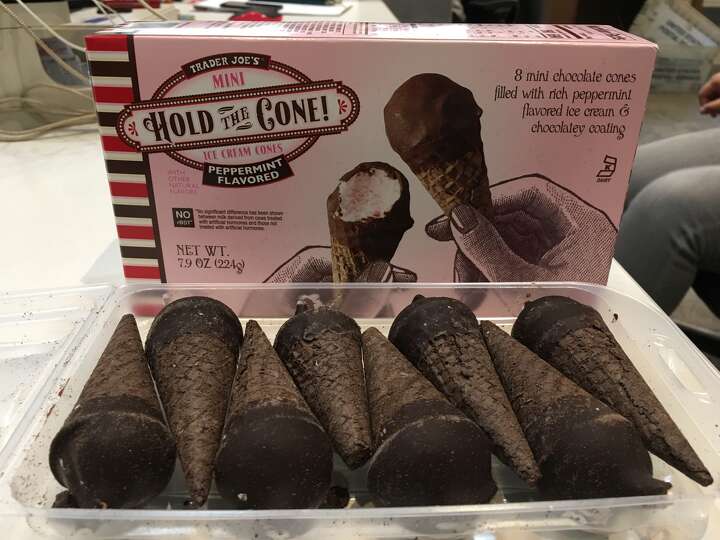
The width and height of the screenshot is (720, 540). I want to click on trays, so click(494, 297).